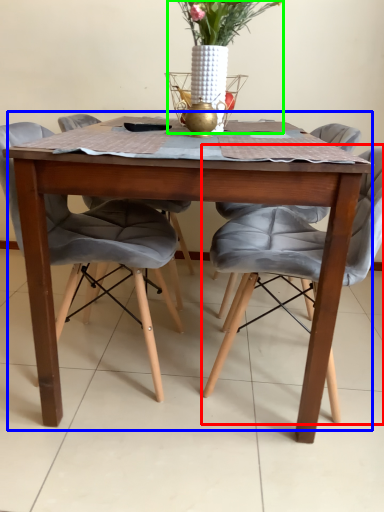
Question: Which object is the farthest from chair (highlighted by a red box)? Choose among these: kitchen & dining room table (highlighted by a blue box) or floral arrangement (highlighted by a green box).

Choices:
 (A) kitchen & dining room table
 (B) floral arrangement

Answer: (B)